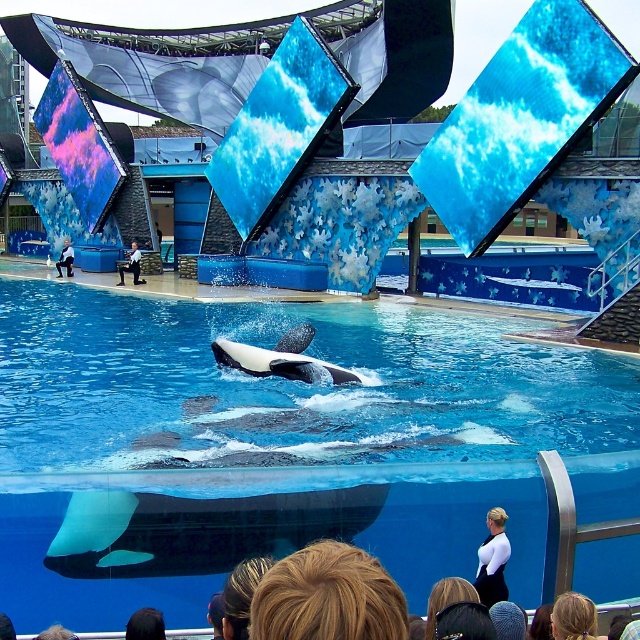
Does white fabric at lower right have a smaller size compared to dark brown hair at lower center?

Incorrect, white fabric at lower right is not smaller in size than dark brown hair at lower center.

This screenshot has width=640, height=640. What are the coordinates of `white fabric at lower right` in the screenshot? It's located at [492, 560].

Who is more forward, (557,634) or (145,618)?

Positioned in front is point (557,634).

Is blonde hair at lower right taller than dark brown hair at lower center?

Yes.

Which is behind, point (588, 608) or point (131, 624)?

The point (131, 624) is behind.

Find the location of a particular element. The image size is (640, 640). blonde hair at lower right is located at coordinates (573, 618).

Based on the photo, can you confirm if white fabric at lower right is positioned to the right of black suit at center?

Correct, you'll find white fabric at lower right to the right of black suit at center.

Is point (504, 563) positioned in front of point (131, 266)?

Yes.

Locate an element on the screen. The image size is (640, 640). white fabric at lower right is located at coordinates coord(492,560).